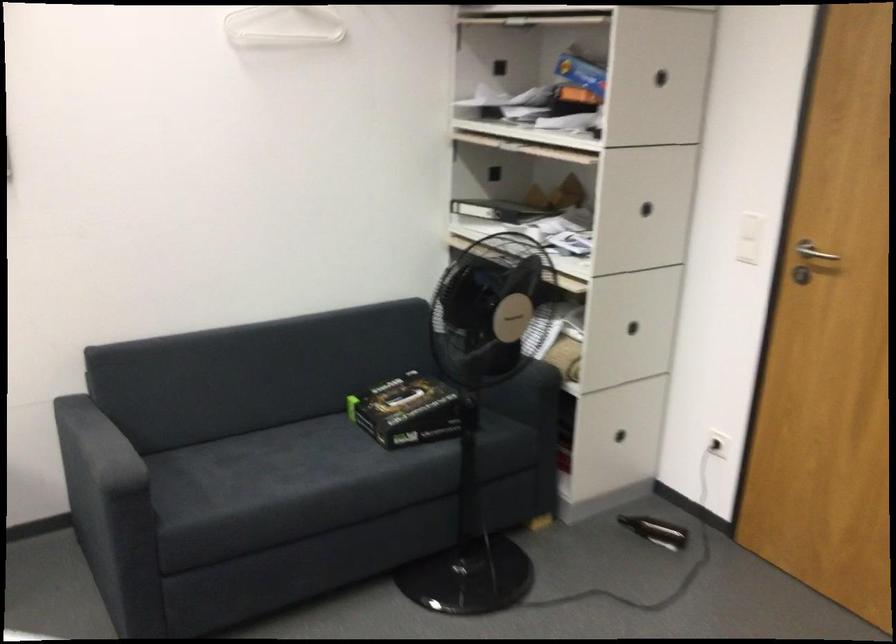
The width and height of the screenshot is (896, 644). Describe the element at coordinates (268, 462) in the screenshot. I see `a dark sofa sitting surface` at that location.